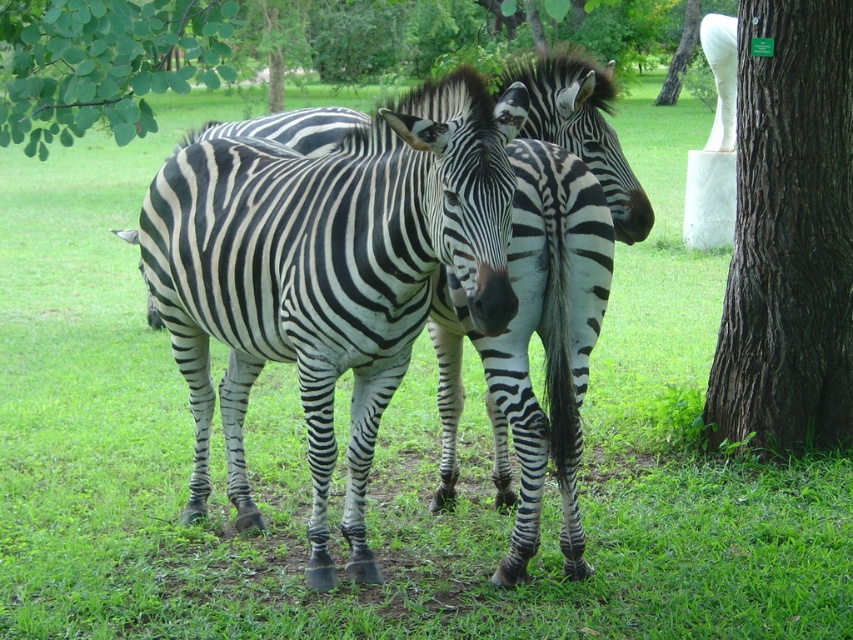
Is green leafy branch at upper left above white marble statue at upper right?

No, green leafy branch at upper left is not above white marble statue at upper right.

This screenshot has width=853, height=640. I want to click on green leafy branch at upper left, so click(x=102, y=64).

Does black and white striped zebra at center have a lesser width compared to green leafy branch at upper left?

In fact, black and white striped zebra at center might be wider than green leafy branch at upper left.

Is point (253, 253) farther from camera compared to point (91, 56)?

Yes, point (253, 253) is behind point (91, 56).

This screenshot has width=853, height=640. In order to click on black and white striped zebra at center in this screenshot , I will do `click(329, 275)`.

Find the location of a particular element. black and white striped zebra at center is located at coordinates (329, 275).

Is black and white striped zebra at center below dark brown textured bark at right?

Yes.

Is point (460, 248) positioned after point (804, 40)?

No, it is in front of (804, 40).

The image size is (853, 640). I want to click on black and white striped zebra at center, so click(x=329, y=275).